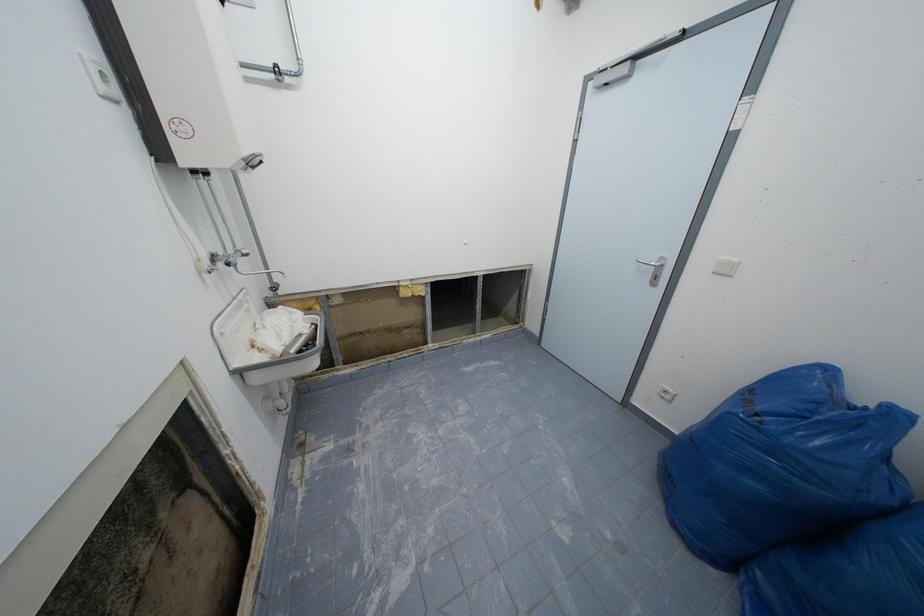
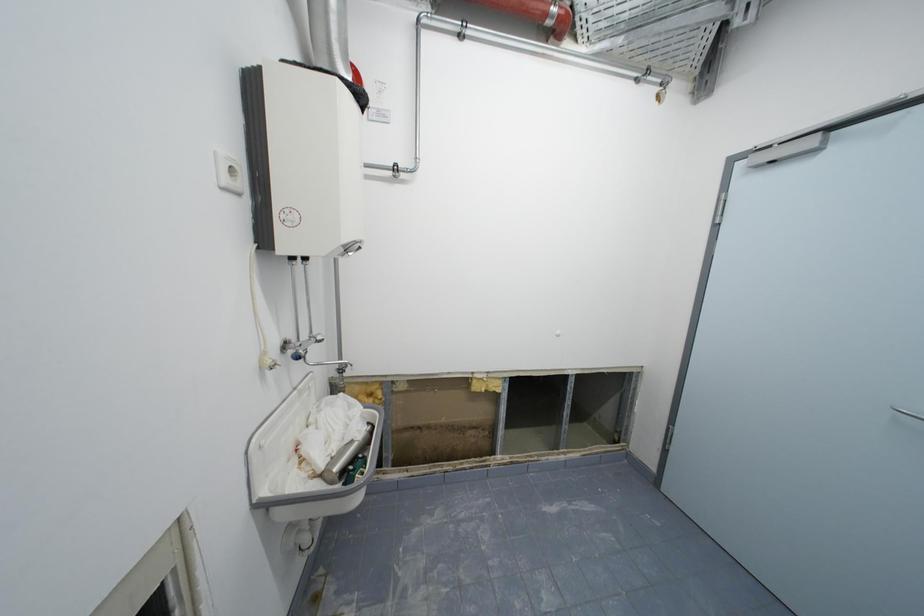
Consider the image. The images are taken continuously from a first-person perspective. In which direction are you moving?

The movement direction of the cameraman is left, forward.